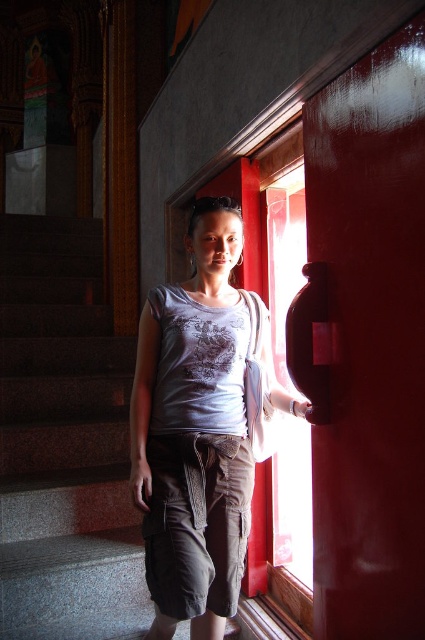
Question: Does gray granite stairs at left have a larger size compared to matte gray shirt at center?

Choices:
 (A) no
 (B) yes

Answer: (B)

Question: Which point is closer to the camera taking this photo?

Choices:
 (A) (359, 380)
 (B) (203, 433)
 (C) (25, 509)

Answer: (A)

Question: Which object is the farthest from the glossy red door handle at right?

Choices:
 (A) gray granite stairs at left
 (B) matte gray shirt at center

Answer: (A)

Question: Which point is closer to the camera taking this photo?

Choices:
 (A) (200, 228)
 (B) (402, 250)
 (C) (138, 632)

Answer: (B)

Question: Can you confirm if glossy red door handle at right is bigger than gray granite stairs at left?

Choices:
 (A) no
 (B) yes

Answer: (A)

Question: Is gray granite stairs at left smaller than matte gray shirt at center?

Choices:
 (A) yes
 (B) no

Answer: (B)